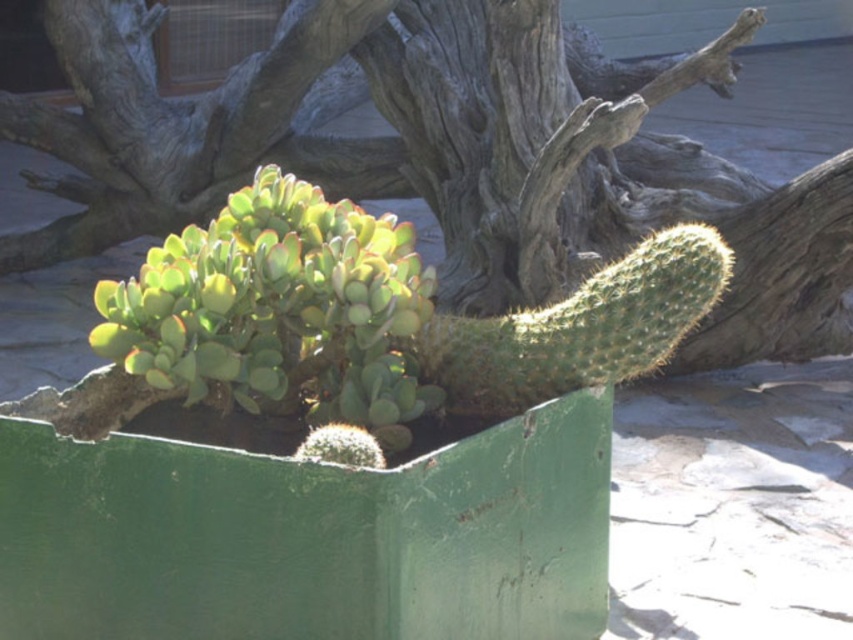
Does point (514, 525) come closer to viewer compared to point (379, 467)?

No, (514, 525) is behind (379, 467).

Between green painted metal box at center and green spiky cactus at center, which one has more height?

green painted metal box at center

Image resolution: width=853 pixels, height=640 pixels. In order to click on green painted metal box at center in this screenshot , I will do `click(308, 536)`.

Which is behind, point (155, 144) or point (68, 493)?

Positioned behind is point (155, 144).

Where is `green rough bark tree at center`? The height and width of the screenshot is (640, 853). green rough bark tree at center is located at coordinates (445, 156).

Which is behind, point (453, 244) or point (276, 476)?

The point (453, 244) is behind.

Where is `green rough bark tree at center`? green rough bark tree at center is located at coordinates (445, 156).

Can you confirm if green rough bark tree at center is positioned to the left of green spiky cactus at center?

Correct, you'll find green rough bark tree at center to the left of green spiky cactus at center.

Based on the photo, can you confirm if green rough bark tree at center is taller than green spiky cactus at center?

Correct, green rough bark tree at center is much taller as green spiky cactus at center.

You are a GUI agent. You are given a task and a screenshot of the screen. Output one action in this format:
    pyautogui.click(x=<x>, y=<y>)
    Task: Click on the green rough bark tree at center
    This screenshot has width=853, height=640.
    Given the screenshot: What is the action you would take?
    click(445, 156)